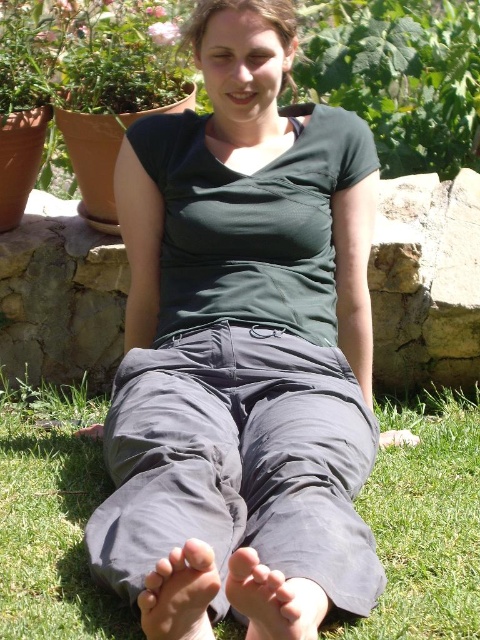
You are a photographer setting up a shot of the scene. You want to position a small tripod between the green leafy plant at upper center and the gray fabric foot at lower center. Based on their positions, which object should the tripod be closer to?

The tripod should be placed closer to the gray fabric foot at lower center because the green leafy plant at upper center is positioned to the right of the gray fabric foot at lower center, meaning the foot is further to the left and the plant is to the right. Since the tripod is between them, it would naturally be closer to whichever is nearer in the spatial arrangement. However, based on the description stating the plant is to the right of the foot, the foot is to the left of the plant. Therefore, if the

You are a photographer setting up a shoot on a grassy area with a stone wall. You need to position two props, a gray fabric foot at lower center and a smooth gray foot at lower center, such that they are exactly 6 inches apart. Based on the current setup shown in the image, will you need to move the props closer together or farther apart to achieve the desired distance?

The current distance between the gray fabric foot at lower center and the smooth gray foot at lower center is 5.46 inches. To reach the desired 6 inches, you need to move them slightly farther apart.

You are a photographer setting up a shot of the scene. You notice two gray feet at the lower center of the image. Which foot is positioned closer to you, the gray fabric foot at lower center or the smooth gray foot at lower center?

The gray fabric foot at lower center is closer to the viewer than the smooth gray foot at lower center.